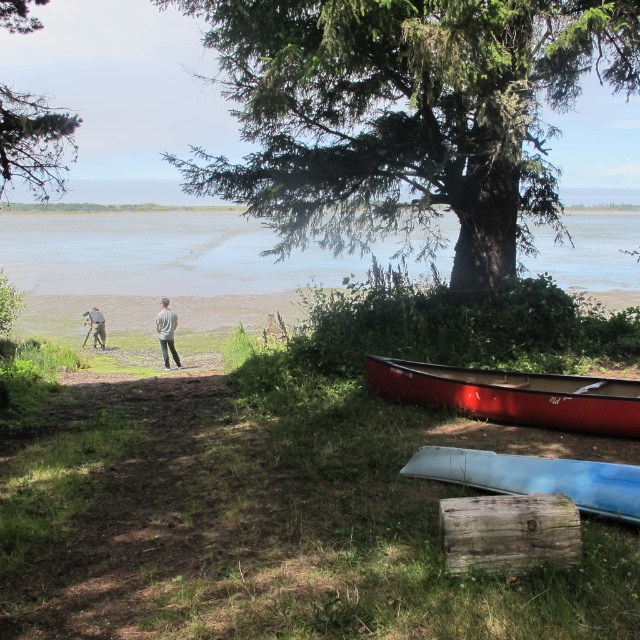
Question: Among these objects, which one is nearest to the camera?

Choices:
 (A) green textured tree at upper center
 (B) light brown leather jacket at center
 (C) blue matte canoe at lower right

Answer: (C)

Question: Which of the following is the closest to the observer?

Choices:
 (A) green leafy tree at upper left
 (B) shiny red canoe at lower right

Answer: (B)

Question: Does green textured tree at upper center have a lesser width compared to shiny red canoe at lower right?

Choices:
 (A) yes
 (B) no

Answer: (B)

Question: Is green leafy tree at upper left wider than gray fabric pants at center?

Choices:
 (A) no
 (B) yes

Answer: (B)

Question: Does brown sandy water at center appear on the left side of shiny red canoe at lower right?

Choices:
 (A) yes
 (B) no

Answer: (A)

Question: Which point is closer to the camera?

Choices:
 (A) blue matte canoe at lower right
 (B) green textured tree at upper center

Answer: (A)